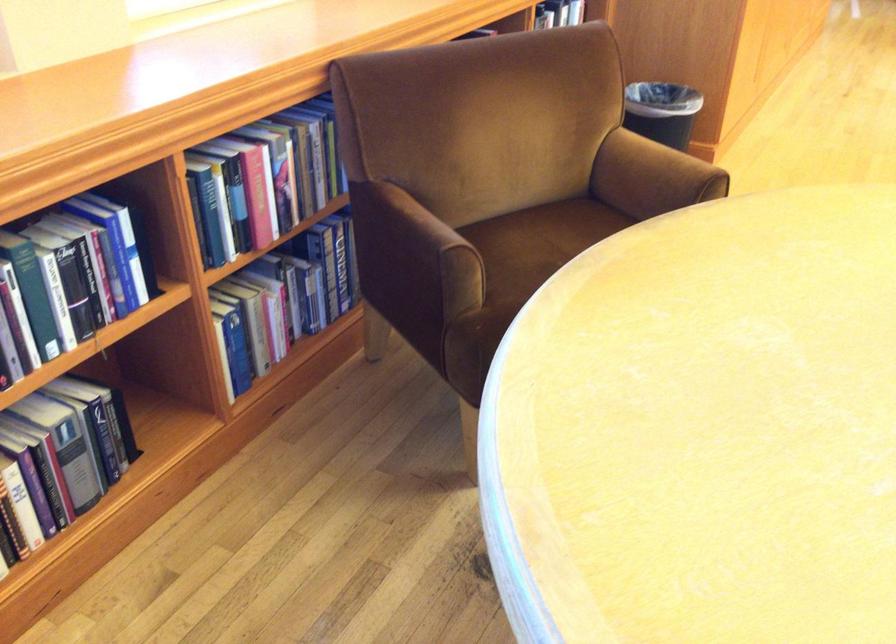
The image size is (896, 644). Describe the element at coordinates (538, 242) in the screenshot. I see `a brown chair sitting surface` at that location.